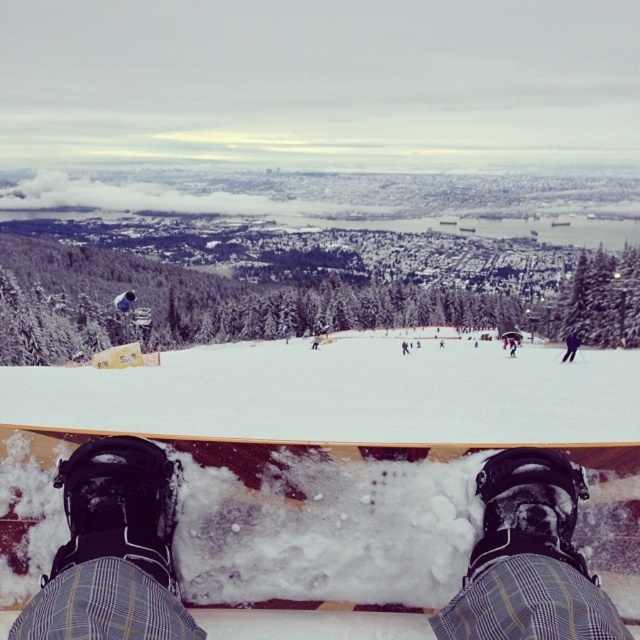
You are a photographer at the edge of the ski slope. You want to capture a photo that includes both the white snowboard at center and the black matte snowboarder at center. Based on their positions, which object should appear lower in the photo?

The white snowboard at center is located below the black matte snowboarder at center, so in the photo, the white snowboard at center will appear lower than the black matte snowboarder at center.

You are a photographer at the edge of the ski slope. You want to take a photo of the black matte snowboard boots at lower center and the black matte snowboarder at center. Based on their heights, which object should appear smaller in the photo?

The black matte snowboard boots at lower center has a lesser height compared to the black matte snowboarder at center, so the black matte snowboard boots at lower center will appear smaller in the photo.

Looking at this image, you are a snowboarder preparing to take a photo. You want to ensure that both the white snowboard at center and the black matte snowboard boots at lower center appear in the frame. Based on their positions, which object should you focus on first to include both in your shot?

The white snowboard at center is positioned on the right side of black matte snowboard boots at lower center, so focusing on the black matte snowboard boots at lower center first would help ensure both objects are included in the frame since they are positioned next to each other.